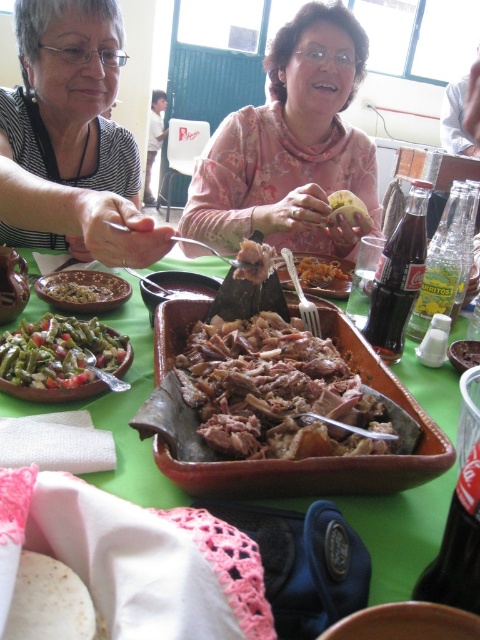
Question: Which of the following is the closest to the observer?

Choices:
 (A) (166, 291)
 (B) (144, 200)
 (C) (465, 348)
 (D) (345, 74)

Answer: (A)

Question: Among these objects, which one is farthest from the camera?

Choices:
 (A) green matte beans at center
 (B) brown crispy skin at center
 (C) white creamy sauce at center
 (D) matte black shirt at upper left

Answer: (C)

Question: In this image, where is brown matte sauce at center located relative to white creamy sauce at center?

Choices:
 (A) right
 (B) left

Answer: (B)

Question: Does dark glass coca-cola at center right appear on the right side of brown matte sauce at center?

Choices:
 (A) yes
 (B) no

Answer: (A)

Question: Estimate the real-world distances between objects in this image. Which object is farther from the dark glass coca-cola at center right?

Choices:
 (A) yellow matte potato at center
 (B) floral fabric shirt at center
 (C) brown crumbly bread at center

Answer: (B)

Question: Can you confirm if matte black shirt at upper left is smaller than brown matte sauce at center?

Choices:
 (A) yes
 (B) no

Answer: (B)